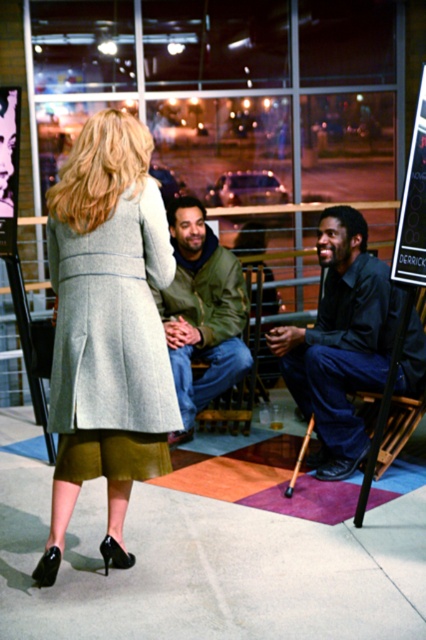
Question: Estimate the real-world distances between objects in this image. Which object is closer to the light gray wool coat at center?

Choices:
 (A) dark blue jeans at lower right
 (B) matte gray coat at center
 (C) green matte jacket at center

Answer: (B)

Question: Is light gray wool coat at center in front of green matte jacket at center?

Choices:
 (A) yes
 (B) no

Answer: (A)

Question: Considering the real-world distances, which object is farthest from the green matte jacket at center?

Choices:
 (A) light gray wool coat at center
 (B) matte gray coat at center
 (C) dark blue jeans at lower right

Answer: (A)

Question: Which object is the closest to the green matte jacket at center?

Choices:
 (A) matte gray coat at center
 (B) light gray wool coat at center
 (C) dark blue jeans at lower right

Answer: (C)

Question: Is matte gray coat at center in front of dark blue jeans at lower right?

Choices:
 (A) yes
 (B) no

Answer: (A)

Question: Can you confirm if light gray wool coat at center is positioned to the left of dark blue jeans at lower right?

Choices:
 (A) no
 (B) yes

Answer: (B)